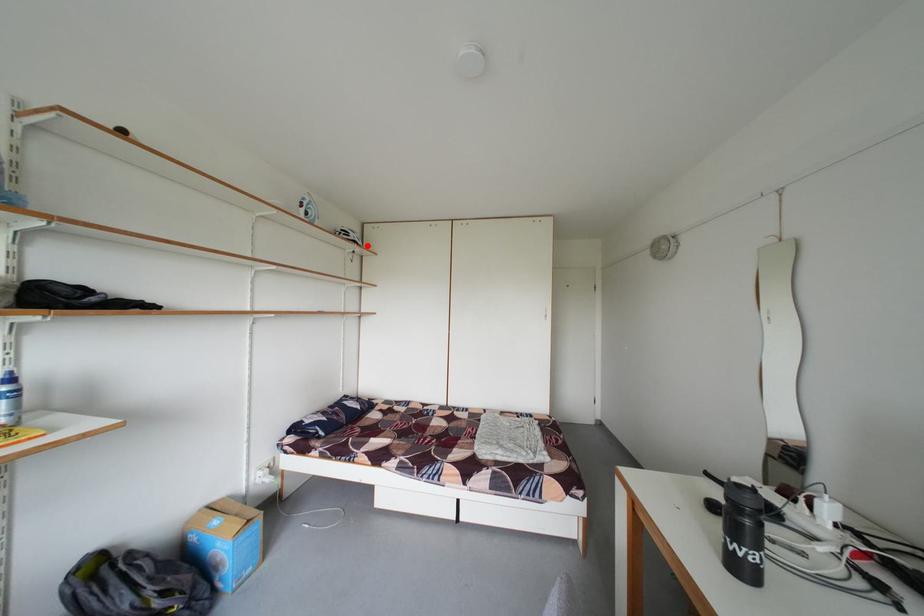
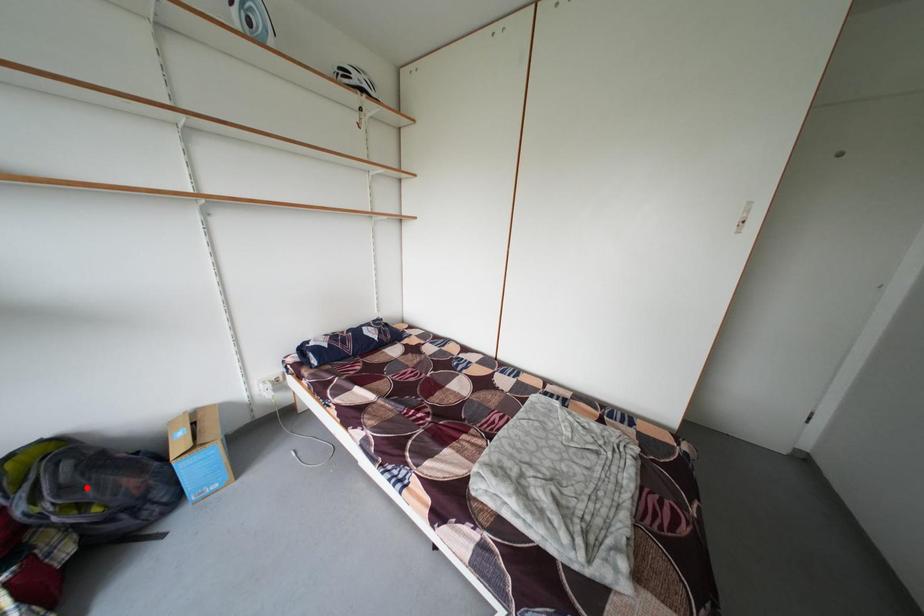
I am providing you with two images of the same scene from different viewpoints. A red point is marked on the first image and another point is marked on the second image. Are the points marked in image1 and image2 representing the same 3D position?

No